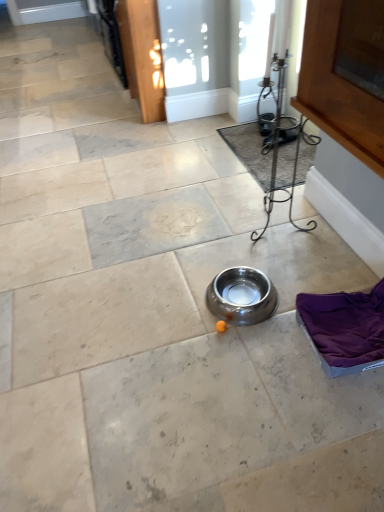
You are a GUI agent. You are given a task and a screenshot of the screen. Output one action in this format:
    pyautogui.click(x=<x>, y=<y>)
    Task: Click on the vacant area that is in front of carpeted mat at center
    
    Given the screenshot: What is the action you would take?
    pyautogui.click(x=255, y=217)